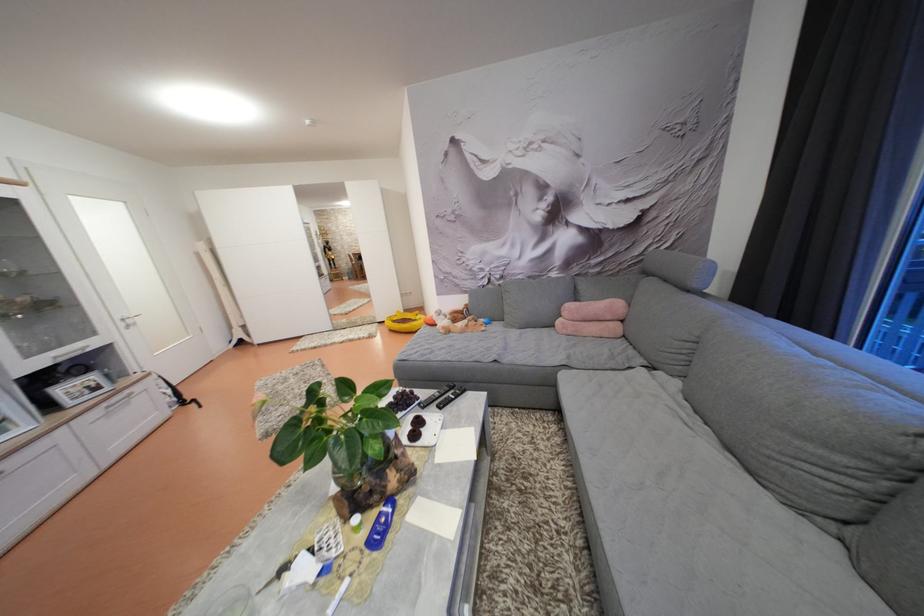
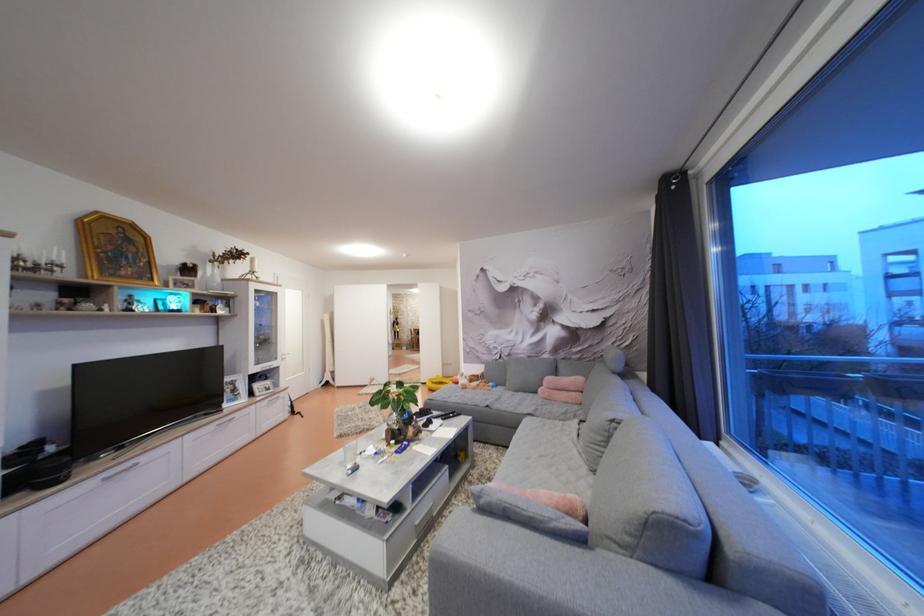
Locate, in the second image, the point that corresponds to the point at 578,310 in the first image.

(556, 384)